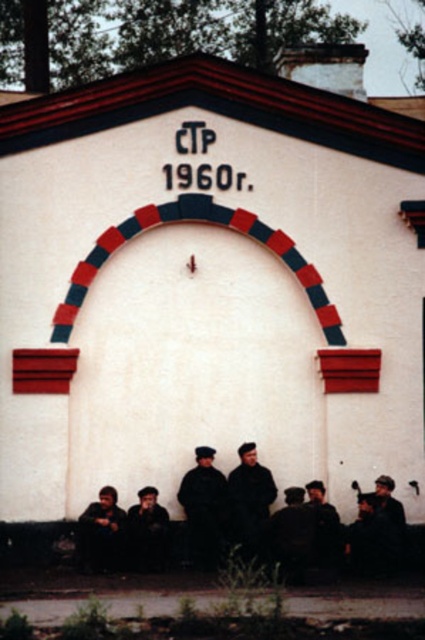
Question: Among these points, which one is farthest from the camera?

Choices:
 (A) (223, 538)
 (B) (104, 508)

Answer: (B)

Question: Can you confirm if dark gray uniform at center is positioned above dark brown leather jacket at lower left?

Choices:
 (A) yes
 (B) no

Answer: (A)

Question: Is dark gray uniform at center thinner than dark brown leather jacket at lower left?

Choices:
 (A) no
 (B) yes

Answer: (B)

Question: Which of the following is the closest to the observer?

Choices:
 (A) (85, 520)
 (B) (215, 481)

Answer: (A)

Question: Does dark gray uniform at center have a larger size compared to dark brown leather jacket at lower left?

Choices:
 (A) no
 (B) yes

Answer: (B)

Question: Which object appears farthest from the camera in this image?

Choices:
 (A) dark gray uniform at center
 (B) dark brown leather jacket at lower left

Answer: (A)